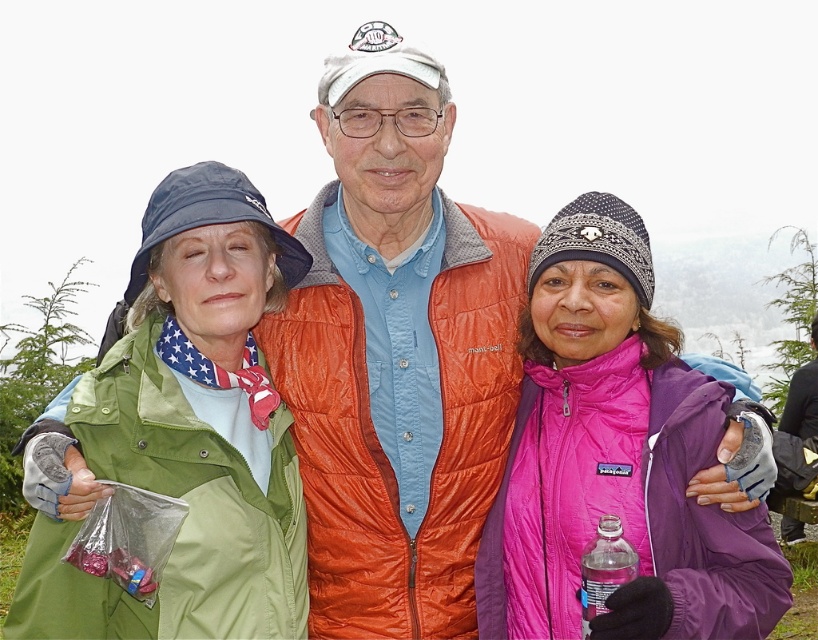
What is the color of the fabric at the point with coordinates (189, 429)?

The point with coordinates (189, 429) is on the green fabric jacket at left, so the color is green.